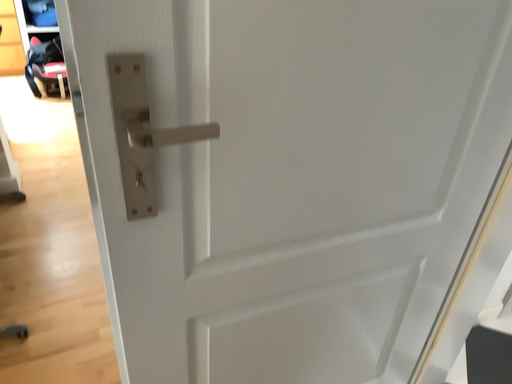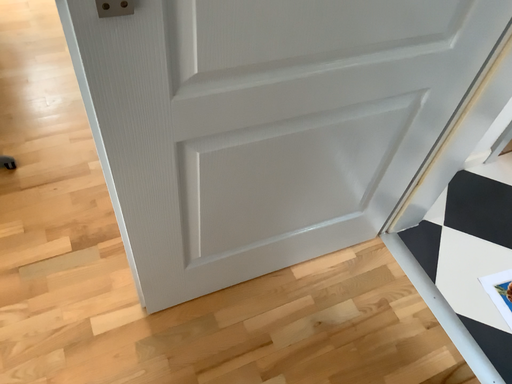
Question: Which way did the camera rotate in the video?

Choices:
 (A) rotated downward
 (B) rotated upward

Answer: (A)